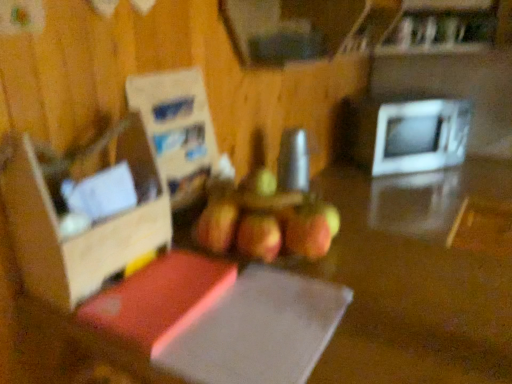
Where is `cardboard box at left`? cardboard box at left is located at coordinates (85, 231).

What do you see at coordinates (410, 135) in the screenshot?
I see `white glossy microwave at right` at bounding box center [410, 135].

Locate an element on the screen. The image size is (512, 384). cardboard box at left is located at coordinates (85, 231).

Consider the image. From a real-world perspective, which object stands above the other?

cardboard box at left.

Is white glossy microwave at right looking in the opposite direction of cardboard box at left?

No, white glossy microwave at right's orientation is not away from cardboard box at left.

Is white glossy microwave at right wider or thinner than cardboard box at left?

In the image, white glossy microwave at right appears to be wider than cardboard box at left.

Which is behind, point (442, 117) or point (35, 189)?

The point (442, 117) is farther.

Is ripe red apple at center bigger than cardboard box at left?

Yes, ripe red apple at center is bigger than cardboard box at left.

Considering the points (270, 219) and (143, 133), which point is in front, point (270, 219) or point (143, 133)?

Positioned in front is point (143, 133).

Considering their positions, is ripe red apple at center located in front of or behind cardboard box at left?

Visually, ripe red apple at center is located behind cardboard box at left.

Who is taller, white glossy microwave at right or ripe red apple at center?

white glossy microwave at right.

Considering the sizes of objects white glossy microwave at right and ripe red apple at center in the image provided, who is smaller, white glossy microwave at right or ripe red apple at center?

ripe red apple at center is smaller.

Is white glossy microwave at right looking in the opposite direction of ripe red apple at center?

No, ripe red apple at center is not at the back of white glossy microwave at right.

Is cardboard box at left positioned in front of white glossy microwave at right?

Yes, cardboard box at left is closer to the viewer.

Considering the sizes of objects cardboard box at left and white glossy microwave at right in the image provided, who is thinner, cardboard box at left or white glossy microwave at right?

cardboard box at left.

Can we say cardboard box at left lies outside white glossy microwave at right?

Yes.

Locate an element on the screen. The width and height of the screenshot is (512, 384). box on the left side of white glossy microwave at right is located at coordinates (85, 231).

From a real-world perspective, is ripe red apple at center located beneath white glossy microwave at right?

No, from a real-world perspective, ripe red apple at center is not below white glossy microwave at right.

Which is nearer, (262,172) or (451,157)?

The point (262,172) is closer.

Considering the sizes of objects ripe red apple at center and white glossy microwave at right in the image provided, who is taller, ripe red apple at center or white glossy microwave at right?

white glossy microwave at right is taller.

Is there a large distance between ripe red apple at center and white glossy microwave at right?

Absolutely, ripe red apple at center is distant from white glossy microwave at right.

From the image's perspective, which is below, cardboard box at left or ripe red apple at center?

ripe red apple at center is shown below in the image.

Consider the image. From a real-world perspective, between cardboard box at left and ripe red apple at center, who is vertically higher?

From a 3D spatial view, cardboard box at left is above.

Which is less distant, (x=152, y=223) or (x=289, y=222)?

Point (x=152, y=223) is closer to the camera than point (x=289, y=222).

Which is more to the left, cardboard box at left or ripe red apple at center?

Positioned to the left is cardboard box at left.

In the image, there is a cardboard box at left. Where is `microwave oven below it (from a real-world perspective)`? The height and width of the screenshot is (384, 512). microwave oven below it (from a real-world perspective) is located at coordinates (410, 135).

Locate an element on the screen. The height and width of the screenshot is (384, 512). box on the left of ripe red apple at center is located at coordinates (85, 231).

Based on the photo, considering their positions, is cardboard box at left positioned further to ripe red apple at center than white glossy microwave at right?

white glossy microwave at right lies further to ripe red apple at center than the other object.

When comparing their distances from ripe red apple at center, does white glossy microwave at right or cardboard box at left seem further?

white glossy microwave at right is positioned further to the anchor ripe red apple at center.

Based on their spatial positions, is ripe red apple at center or white glossy microwave at right closer to cardboard box at left?

Based on the image, ripe red apple at center appears to be nearer to cardboard box at left.

Looking at the image, which one is located further to cardboard box at left, white glossy microwave at right or ripe red apple at center?

Among the two, white glossy microwave at right is located further to cardboard box at left.

Considering their positions, is cardboard box at left positioned further to white glossy microwave at right than ripe red apple at center?

The object further to white glossy microwave at right is cardboard box at left.

Looking at the image, which one is located further to white glossy microwave at right, ripe red apple at center or cardboard box at left?

Based on the image, cardboard box at left appears to be further to white glossy microwave at right.

The height and width of the screenshot is (384, 512). In order to click on apple between cardboard box at left and white glossy microwave at right in the front-back direction in this screenshot , I will do tap(265, 220).